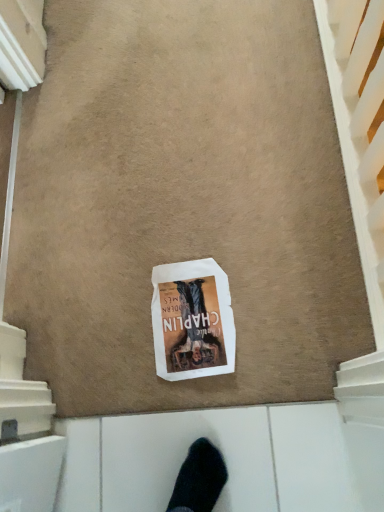
Locate an element on the screen. blank space to the left of white paper bag at center is located at coordinates (102, 339).